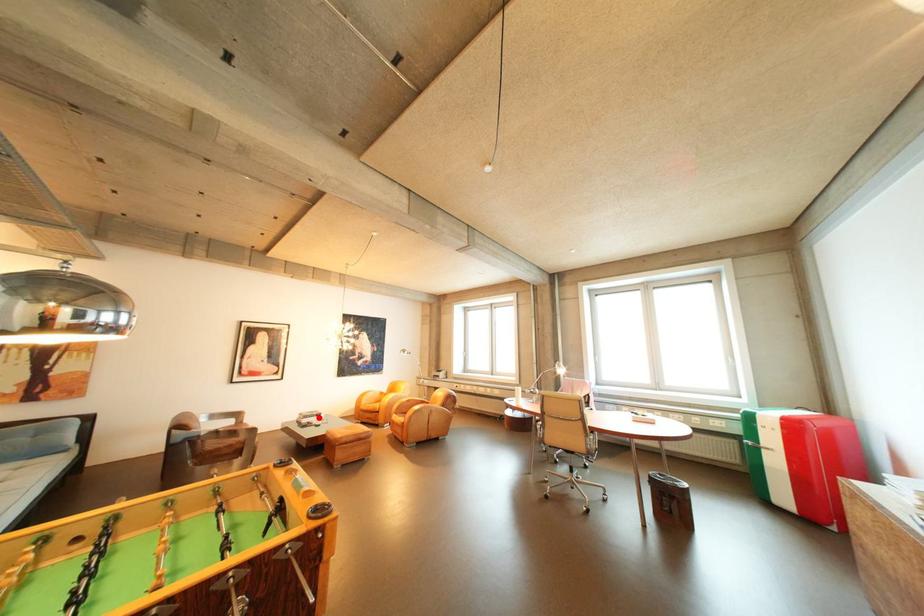
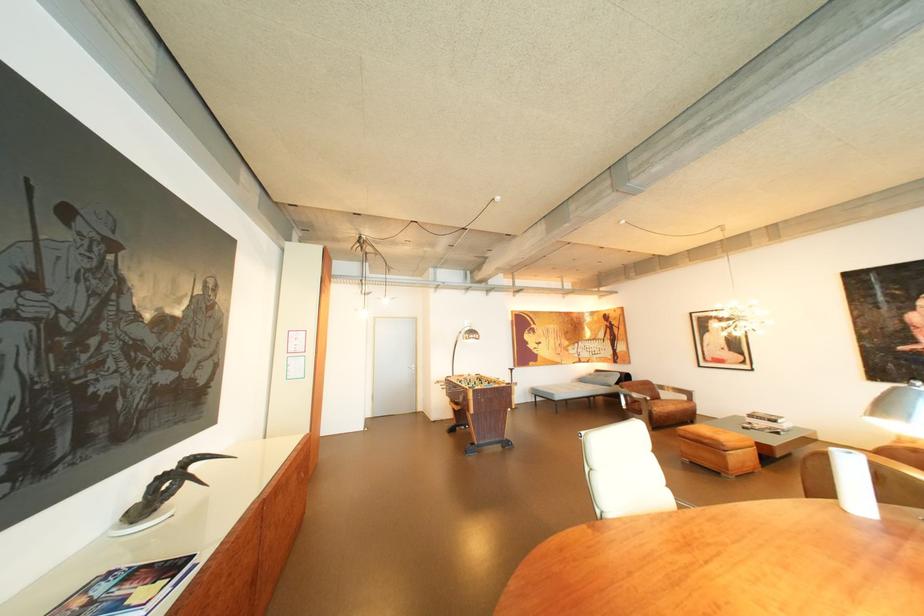
The point at the highlighted location is marked in the first image. Where is the corresponding point in the second image?

(763, 416)